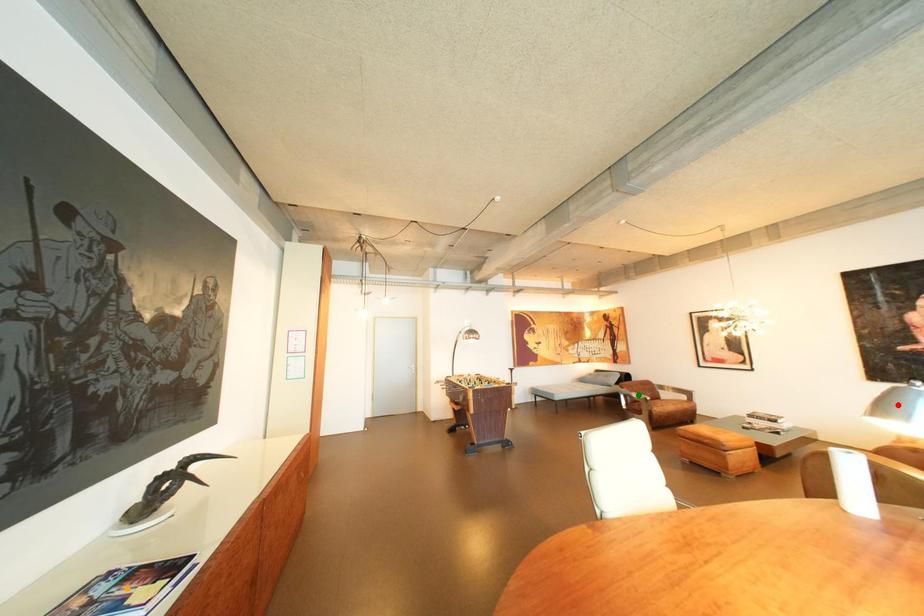
Order these from nearest to farthest:
green point
orange point
red point

1. orange point
2. red point
3. green point